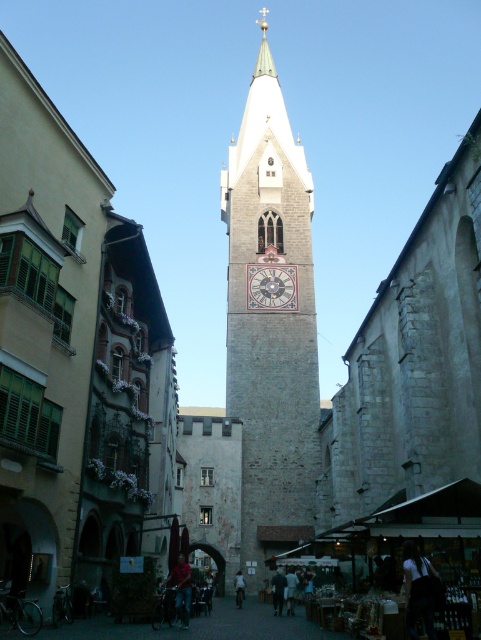
Can you confirm if white stone clock tower at center is smaller than white painted stone clock at center?

No, white stone clock tower at center is not smaller than white painted stone clock at center.

Between white stone clock tower at center and white painted stone clock at center, which one appears on the left side from the viewer's perspective?

Positioned to the left is white stone clock tower at center.

The image size is (481, 640). Find the location of `white stone clock tower at center`. white stone clock tower at center is located at coordinates (270, 324).